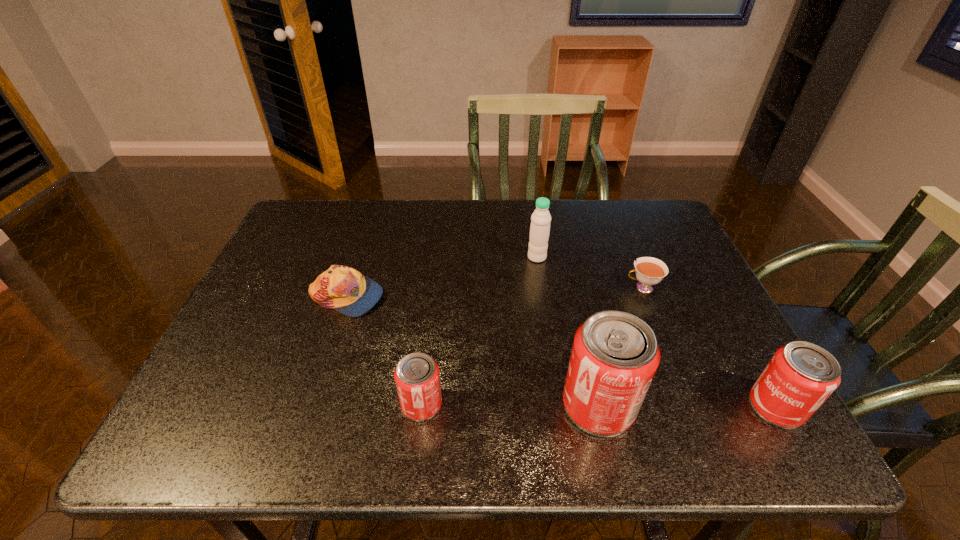
The width and height of the screenshot is (960, 540). Identify the location of free point at the far edge. (475, 240).

Locate an element on the screen. This screenshot has width=960, height=540. vacant space at the near edge of the desktop is located at coordinates (369, 382).

This screenshot has width=960, height=540. I want to click on free space at the left edge of the desktop, so click(271, 359).

Locate an element on the screen. vacant space at the right edge is located at coordinates (678, 315).

This screenshot has height=540, width=960. I want to click on vacant space at the near left corner of the desktop, so click(x=259, y=377).

Locate an element on the screen. The width and height of the screenshot is (960, 540). vacant space at the near right corner of the desktop is located at coordinates (697, 381).

Identify the location of vacant area that lies between the farthest object and the leftmost can. (479, 330).

Where is `free area in between the second object from left to right and the cap`? The image size is (960, 540). free area in between the second object from left to right and the cap is located at coordinates (384, 350).

This screenshot has width=960, height=540. In order to click on vacant area between the water bottle and the second shortest can in this screenshot , I will do `click(657, 332)`.

Image resolution: width=960 pixels, height=540 pixels. In order to click on vacant space that's between the shortest can and the cap in this screenshot , I will do `click(384, 350)`.